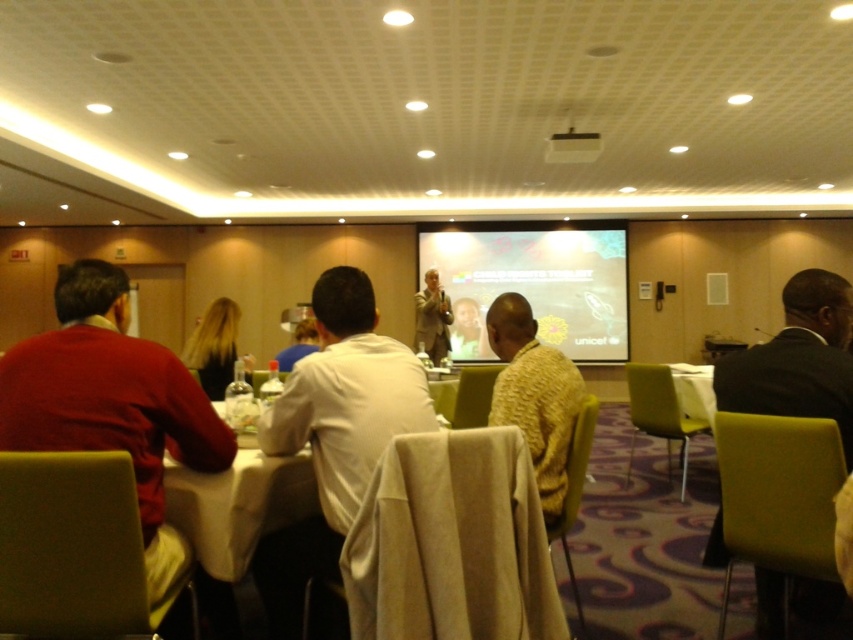
Between point (316, 284) and point (468, 333), which one is positioned behind?

The point (468, 333) is more distant.

Where is `white matte shirt at center`? This screenshot has height=640, width=853. white matte shirt at center is located at coordinates (335, 433).

Does point (810, 294) lie in front of point (579, 150)?

Yes, point (810, 294) is closer to viewer.

Does black suit at right appear on the left side of white plastic projector at upper center?

Incorrect, black suit at right is not on the left side of white plastic projector at upper center.

Does point (752, 358) lie in front of point (599, 138)?

Yes, point (752, 358) is closer to viewer.

The width and height of the screenshot is (853, 640). Identify the location of black suit at right. (798, 358).

Can you confirm if yellow knitted sweater at center is bigger than white plastic projector at upper center?

Yes.

Does yellow knitted sweater at center appear on the left side of white plastic projector at upper center?

Correct, you'll find yellow knitted sweater at center to the left of white plastic projector at upper center.

Where is `yellow knitted sweater at center`? The width and height of the screenshot is (853, 640). yellow knitted sweater at center is located at coordinates (534, 396).

What are the coordinates of `yellow knitted sweater at center` in the screenshot? It's located at (534, 396).